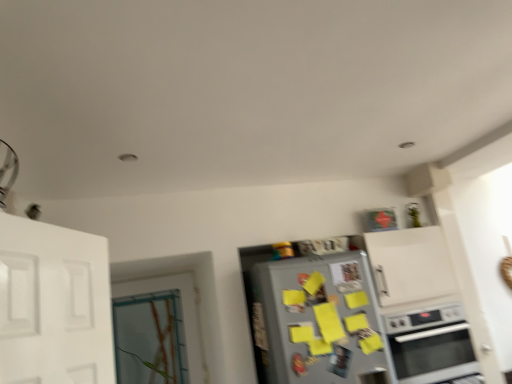
Question: Is silver metallic refrigerator at center completely or partially outside of satin silver oven at lower right?

Choices:
 (A) no
 (B) yes

Answer: (B)

Question: From a real-world perspective, is silver metallic refrigerator at center over satin silver oven at lower right?

Choices:
 (A) yes
 (B) no

Answer: (A)

Question: Is silver metallic refrigerator at center in front of satin silver oven at lower right?

Choices:
 (A) no
 (B) yes

Answer: (B)

Question: Is silver metallic refrigerator at center thinner than satin silver oven at lower right?

Choices:
 (A) no
 (B) yes

Answer: (B)

Question: Can you confirm if silver metallic refrigerator at center is wider than satin silver oven at lower right?

Choices:
 (A) no
 (B) yes

Answer: (A)

Question: From the image's perspective, is silver metallic refrigerator at center below satin silver oven at lower right?

Choices:
 (A) yes
 (B) no

Answer: (B)

Question: From a real-world perspective, is silver metallic refrigerator at center located higher than clear glass door at left?

Choices:
 (A) yes
 (B) no

Answer: (B)

Question: Is silver metallic refrigerator at center to the left of clear glass door at left from the viewer's perspective?

Choices:
 (A) no
 (B) yes

Answer: (A)

Question: Can you confirm if silver metallic refrigerator at center is bigger than clear glass door at left?

Choices:
 (A) yes
 (B) no

Answer: (A)

Question: Is silver metallic refrigerator at center facing towards clear glass door at left?

Choices:
 (A) yes
 (B) no

Answer: (B)

Question: Does silver metallic refrigerator at center have a lesser width compared to clear glass door at left?

Choices:
 (A) yes
 (B) no

Answer: (B)

Question: From the image's perspective, does silver metallic refrigerator at center appear lower than clear glass door at left?

Choices:
 (A) yes
 (B) no

Answer: (B)

Question: Is satin silver oven at lower right in front of silver metallic refrigerator at center?

Choices:
 (A) no
 (B) yes

Answer: (A)